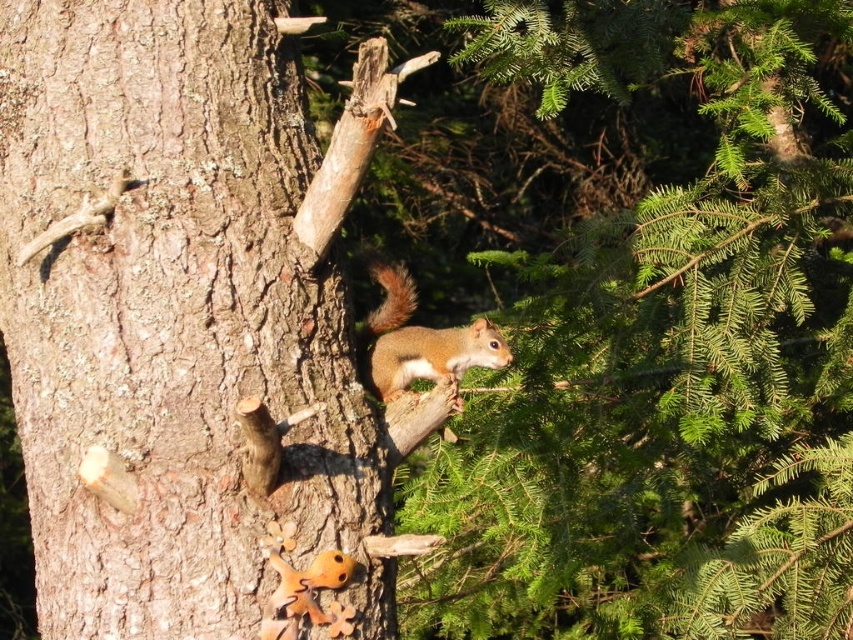
Which is above, rough bark tree trunk at center or brown fuzzy tail at upper center?

brown fuzzy tail at upper center is above.

Is point (241, 136) in front of point (376, 257)?

Yes, it is in front of point (376, 257).

Locate an element on the screen. The height and width of the screenshot is (640, 853). rough bark tree trunk at center is located at coordinates (170, 310).

Can you confirm if shiny brown squirrel at center is positioned below brown fuzzy tail at upper center?

Indeed, shiny brown squirrel at center is positioned under brown fuzzy tail at upper center.

What do you see at coordinates (421, 340) in the screenshot? I see `shiny brown squirrel at center` at bounding box center [421, 340].

Is point (405, 378) farther from viewer compared to point (387, 285)?

No, it is in front of (387, 285).

The image size is (853, 640). What are the coordinates of `shiny brown squirrel at center` in the screenshot? It's located at (421, 340).

Does rough bark tree trunk at center have a larger size compared to shiny brown squirrel at center?

Indeed, rough bark tree trunk at center has a larger size compared to shiny brown squirrel at center.

Does point (207, 456) lie in front of point (405, 276)?

Yes, it is in front of point (405, 276).

In order to click on rough bark tree trunk at center in this screenshot , I will do `click(170, 310)`.